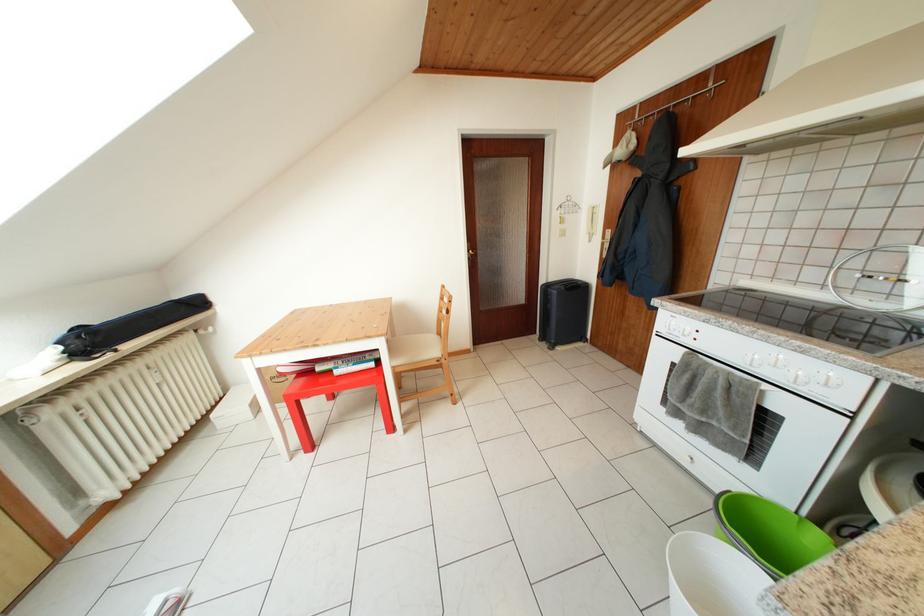
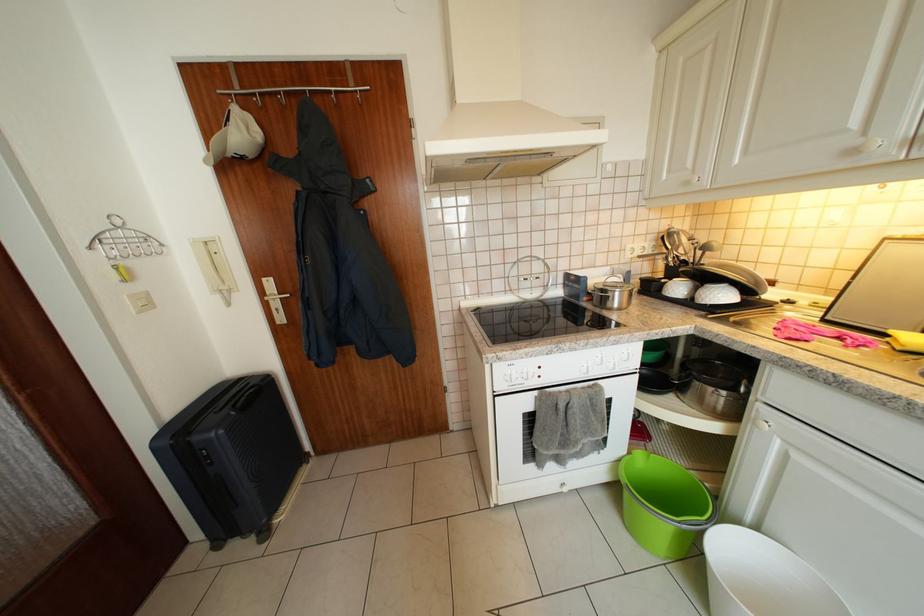
Locate, in the second image, the point that corresponds to point (570, 232) in the first image.

(144, 293)